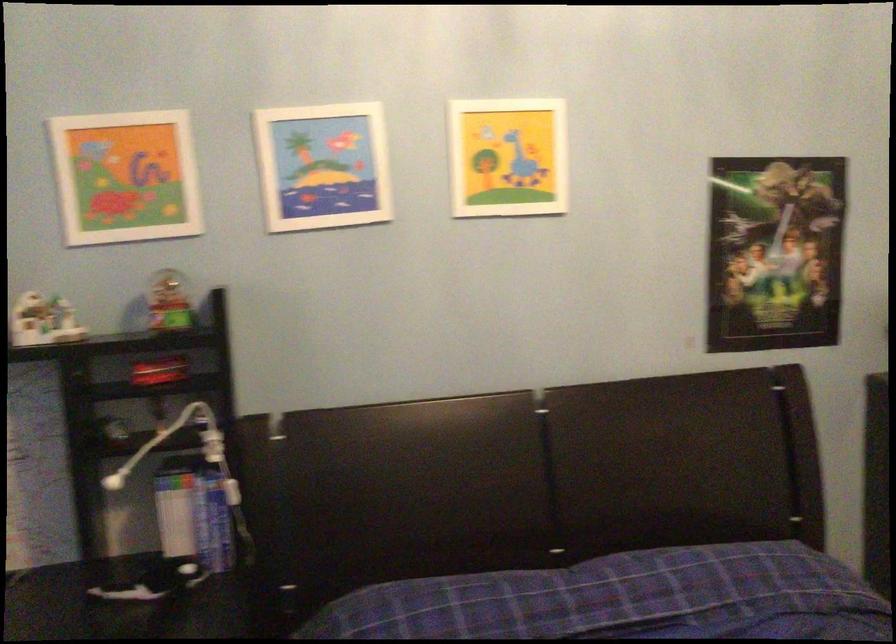
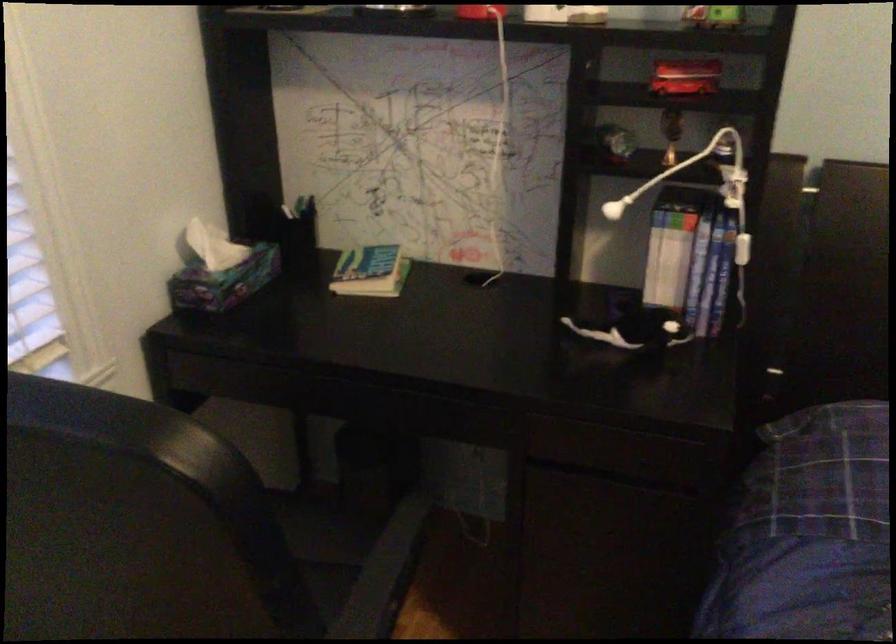
The point at (234, 491) is marked in the first image. Where is the corresponding point in the second image?

(742, 249)